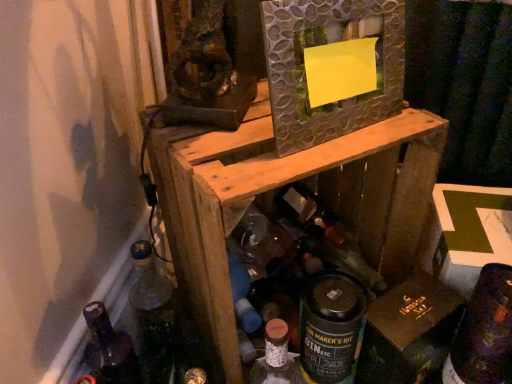
This screenshot has height=384, width=512. What are the coordinates of `green matte can at center, the third bottle positioned from the left` in the screenshot? It's located at (331, 327).

Where is `dark purple glass wine bottle at lower right, arranged as the 2th wine bottle when viewed from the left`? The height and width of the screenshot is (384, 512). dark purple glass wine bottle at lower right, arranged as the 2th wine bottle when viewed from the left is located at coordinates (484, 332).

This screenshot has height=384, width=512. Describe the element at coordinates (310, 214) in the screenshot. I see `translucent glass wine bottle at center, which is the first wine bottle in left-to-right order` at that location.

The image size is (512, 384). Describe the element at coordinates (109, 349) in the screenshot. I see `translucent glass bottle at lower left, positioned as the 1th bottle in left-to-right order` at that location.

Find the location of a particular element. The image size is (512, 384). translucent glass bottle at lower left, the 3th bottle viewed from the right is located at coordinates (109, 349).

At what (x,y) coordinates should I click in order to perform the action: click on green matte can at center, the third bottle positioned from the left. Please return your answer as a coordinate pair (x, y). The height and width of the screenshot is (384, 512). Looking at the image, I should click on (331, 327).

Looking at this image, considering the sizes of translucent glass wine bottle at center, positioned as the 2th wine bottle in bottom-to-top order, and textured silver mirror at center in the image, is translucent glass wine bottle at center, positioned as the 2th wine bottle in bottom-to-top order, taller or shorter than textured silver mirror at center?

translucent glass wine bottle at center, positioned as the 2th wine bottle in bottom-to-top order, is shorter than textured silver mirror at center.

Is translucent glass wine bottle at center, acting as the 2th wine bottle starting from the front, to the left or to the right of textured silver mirror at center in the image?

translucent glass wine bottle at center, acting as the 2th wine bottle starting from the front, is to the right of textured silver mirror at center.

Could you tell me if translucent glass wine bottle at center, acting as the 2th wine bottle starting from the front, is turned towards textured silver mirror at center?

No.

How different are the orientations of wooden crate at center and translucent glass wine bottle at center, which is the first wine bottle in left-to-right order, in degrees?

There is a 3.3-degree angle between the facing directions of wooden crate at center and translucent glass wine bottle at center, which is the first wine bottle in left-to-right order.

Considering the sizes of wooden crate at center and translucent glass wine bottle at center, which is the second wine bottle from right to left, in the image, is wooden crate at center wider or thinner than translucent glass wine bottle at center, which is the second wine bottle from right to left,?

Clearly, wooden crate at center has more width compared to translucent glass wine bottle at center, which is the second wine bottle from right to left.

Does wooden crate at center have a greater height compared to translucent glass wine bottle at center, which is counted as the 1th wine bottle, starting from the top?

Yes.

Which is more to the left, translucent glass bottle at lower left, positioned as the 1th bottle in left-to-right order, or translucent glass bottle at center, which is the second bottle from right to left?

translucent glass bottle at lower left, positioned as the 1th bottle in left-to-right order, is more to the left.

From a real-world perspective, which object rests below the other?

translucent glass bottle at lower left, the 3th bottle viewed from the right, from a real-world perspective.

Is translucent glass bottle at lower left, the 3th bottle viewed from the right, with translucent glass bottle at center, the second bottle from the left?

No, translucent glass bottle at lower left, the 3th bottle viewed from the right, is not with translucent glass bottle at center, the second bottle from the left.

Considering the relative positions of wooden crate at center and translucent glass bottle at center, the second bottle from the left, in the image provided, is wooden crate at center in front of translucent glass bottle at center, the second bottle from the left,?

Yes, it is in front of translucent glass bottle at center, the second bottle from the left.

From the image's perspective, is wooden crate at center beneath translucent glass bottle at center, the second bottle from the left?

Incorrect, from the image's perspective, wooden crate at center is higher than translucent glass bottle at center, the second bottle from the left.

Between wooden crate at center and translucent glass bottle at center, the second bottle from the left, which one has smaller width?

Thinner between the two is translucent glass bottle at center, the second bottle from the left.

What's the angular difference between wooden crate at center and translucent glass bottle at center, the second bottle from the left,'s facing directions?

14.1 degrees.

From the image's perspective, would you say brown cardboard at lower right is shown under wooden crate at center?

Correct, brown cardboard at lower right appears lower than wooden crate at center in the image.

This screenshot has height=384, width=512. In order to click on cardboard box on the right of wooden crate at center in this screenshot , I will do `click(409, 332)`.

Is brown cardboard at lower right far away from wooden crate at center?

brown cardboard at lower right is near wooden crate at center, not far away.

From the image's perspective, is dark purple glass wine bottle at lower right, which is the first wine bottle in right-to-left order, positioned above or below translucent glass wine bottle at center, which is the first wine bottle in left-to-right order?

From the image's perspective, dark purple glass wine bottle at lower right, which is the first wine bottle in right-to-left order, appears below translucent glass wine bottle at center, which is the first wine bottle in left-to-right order.

Based on the photo, are dark purple glass wine bottle at lower right, placed as the second wine bottle when sorted from top to bottom, and translucent glass wine bottle at center, which is the second wine bottle from right to left, making contact?

No, dark purple glass wine bottle at lower right, placed as the second wine bottle when sorted from top to bottom, is not next to translucent glass wine bottle at center, which is the second wine bottle from right to left.

Who is bigger, dark purple glass wine bottle at lower right, arranged as the 2th wine bottle when viewed from the left, or translucent glass wine bottle at center, placed as the 1th wine bottle when sorted from back to front?

dark purple glass wine bottle at lower right, arranged as the 2th wine bottle when viewed from the left.

Is dark purple glass wine bottle at lower right, arranged as the 2th wine bottle when viewed from the left, facing away from translucent glass wine bottle at center, which is counted as the 1th wine bottle, starting from the top?

Yes, dark purple glass wine bottle at lower right, arranged as the 2th wine bottle when viewed from the left, is positioned with its back facing translucent glass wine bottle at center, which is counted as the 1th wine bottle, starting from the top.

Between point (297, 203) and point (303, 330), which one is positioned behind?

Positioned behind is point (297, 203).

Is translucent glass wine bottle at center, which is the second wine bottle from right to left, inside or outside of green matte can at center, which appears as the 1th bottle when viewed from the right?

translucent glass wine bottle at center, which is the second wine bottle from right to left, is not inside green matte can at center, which appears as the 1th bottle when viewed from the right, it's outside.

Image resolution: width=512 pixels, height=384 pixels. In order to click on the 1st bottle counting from the left side of the translucent glass wine bottle at center, which is counted as the 1th wine bottle, starting from the top in this screenshot , I will do `click(331, 327)`.

Which is more to the left, translucent glass wine bottle at center, which is the first wine bottle in left-to-right order, or green matte can at center, the third bottle positioned from the left?

Positioned to the left is green matte can at center, the third bottle positioned from the left.

In order to click on picture frame that is in front of the translucent glass wine bottle at center, which is counted as the 1th wine bottle, starting from the top in this screenshot , I will do `click(329, 44)`.

Identify the location of furniture that is on the left side of translucent glass wine bottle at center, which is the first wine bottle in left-to-right order. The image size is (512, 384). (279, 187).

Considering their positions, is translucent glass wine bottle at center, positioned as the 2th wine bottle in bottom-to-top order, positioned closer to translucent glass bottle at lower left, the 3th bottle viewed from the right, than dark purple glass wine bottle at lower right, which ranks as the second wine bottle in back-to-front order?

translucent glass wine bottle at center, positioned as the 2th wine bottle in bottom-to-top order, lies closer to translucent glass bottle at lower left, the 3th bottle viewed from the right, than the other object.

Looking at the image, which one is located closer to green matte can at center, the third bottle positioned from the left, translucent glass bottle at lower left, positioned as the 1th bottle in left-to-right order, or dark purple glass wine bottle at lower right, arranged as the 2th wine bottle when viewed from the left?

dark purple glass wine bottle at lower right, arranged as the 2th wine bottle when viewed from the left, is positioned closer to the anchor green matte can at center, the third bottle positioned from the left.

From the image, which object appears to be nearer to wooden crate at center, translucent glass bottle at center, which is the second bottle from right to left, or green matte can at center, the third bottle positioned from the left?

green matte can at center, the third bottle positioned from the left, lies closer to wooden crate at center than the other object.

Looking at the image, which one is located further to brown cardboard at lower right, green matte can at center, which appears as the 1th bottle when viewed from the right, or wooden crate at center?

Among the two, wooden crate at center is located further to brown cardboard at lower right.

Which object lies further to the anchor point translucent glass bottle at center, which is the second bottle from right to left, brown cardboard at lower right or translucent glass bottle at lower left, the 3th bottle viewed from the right?

translucent glass bottle at lower left, the 3th bottle viewed from the right, lies further to translucent glass bottle at center, which is the second bottle from right to left, than the other object.

Based on their spatial positions, is translucent glass bottle at center, which is the second bottle from right to left, or wooden crate at center further from textured silver mirror at center?

translucent glass bottle at center, which is the second bottle from right to left, is positioned further to the anchor textured silver mirror at center.

Which object lies nearer to the anchor point brown cardboard at lower right, translucent glass wine bottle at center, which is the first wine bottle in left-to-right order, or translucent glass bottle at center, the second bottle from the left?

translucent glass bottle at center, the second bottle from the left, is closer to brown cardboard at lower right.

Which object lies nearer to the anchor point wooden crate at center, green matte can at center, which appears as the 1th bottle when viewed from the right, or dark purple glass wine bottle at lower right, arranged as the 2th wine bottle when viewed from the left?

green matte can at center, which appears as the 1th bottle when viewed from the right, lies closer to wooden crate at center than the other object.

Where is `bottle between wooden crate at center and brown cardboard at lower right vertically`? The height and width of the screenshot is (384, 512). bottle between wooden crate at center and brown cardboard at lower right vertically is located at coordinates (331, 327).

Image resolution: width=512 pixels, height=384 pixels. What are the coordinates of `bottle located between wooden crate at center and dark purple glass wine bottle at lower right, the first wine bottle viewed from the front, in the left-right direction` in the screenshot? It's located at (331, 327).

Image resolution: width=512 pixels, height=384 pixels. I want to click on furniture between translucent glass bottle at lower left, the 3th bottle viewed from the right, and green matte can at center, the third bottle positioned from the left, so click(279, 187).

At what (x,y) coordinates should I click in order to perform the action: click on bottle situated between translucent glass bottle at center, which is the second bottle from right to left, and dark purple glass wine bottle at lower right, the first wine bottle viewed from the front, from left to right. Please return your answer as a coordinate pair (x, y). Looking at the image, I should click on (331, 327).